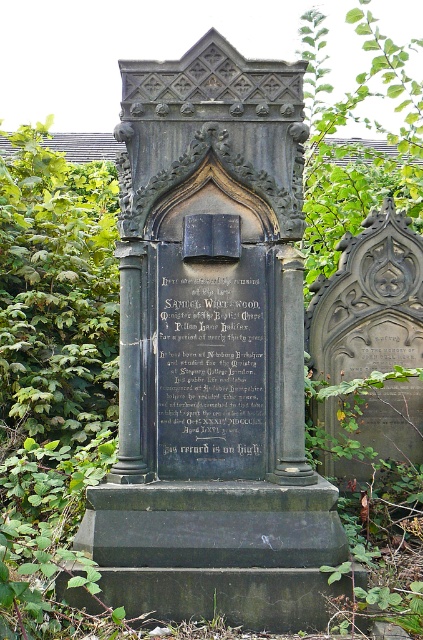
Question: Which object is closer to the camera taking this photo?

Choices:
 (A) dark gray stone monument at center
 (B) black stone plaque at center

Answer: (A)

Question: Which point is closer to the camera taking this photo?

Choices:
 (A) (197, 541)
 (B) (197, 404)

Answer: (A)

Question: Is dark gray stone monument at center smaller than black stone plaque at center?

Choices:
 (A) no
 (B) yes

Answer: (A)

Question: Does dark gray stone monument at center appear on the left side of black stone plaque at center?

Choices:
 (A) no
 (B) yes

Answer: (B)

Question: Is dark gray stone monument at center above black stone plaque at center?

Choices:
 (A) no
 (B) yes

Answer: (B)